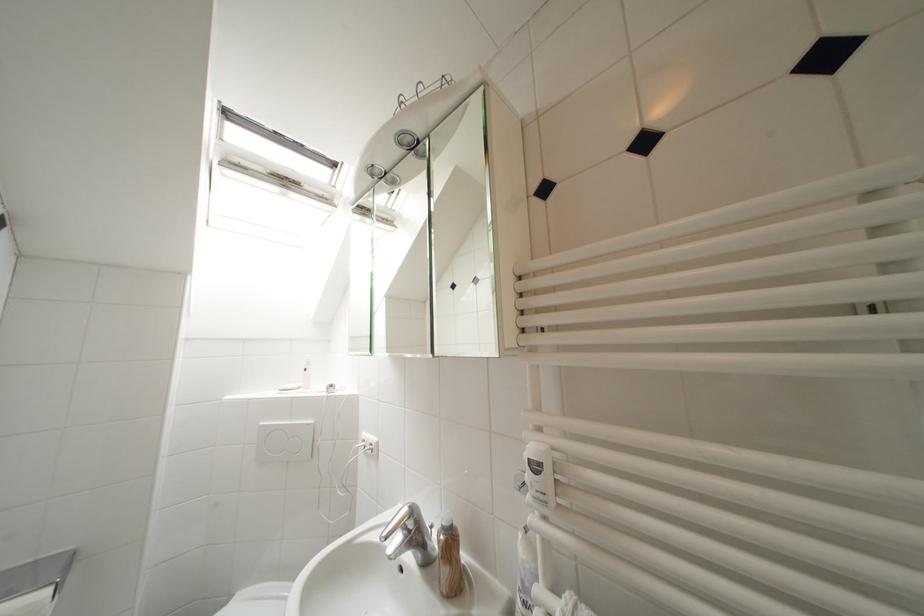
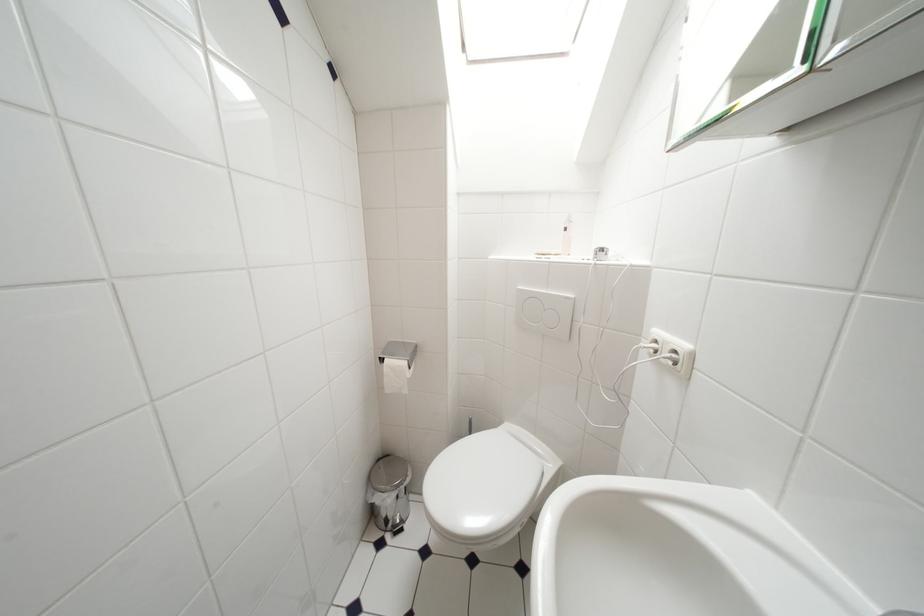
The images are taken continuously from a first-person perspective. In which direction is your viewpoint rotating?

The rotation direction of the camera is left-down.